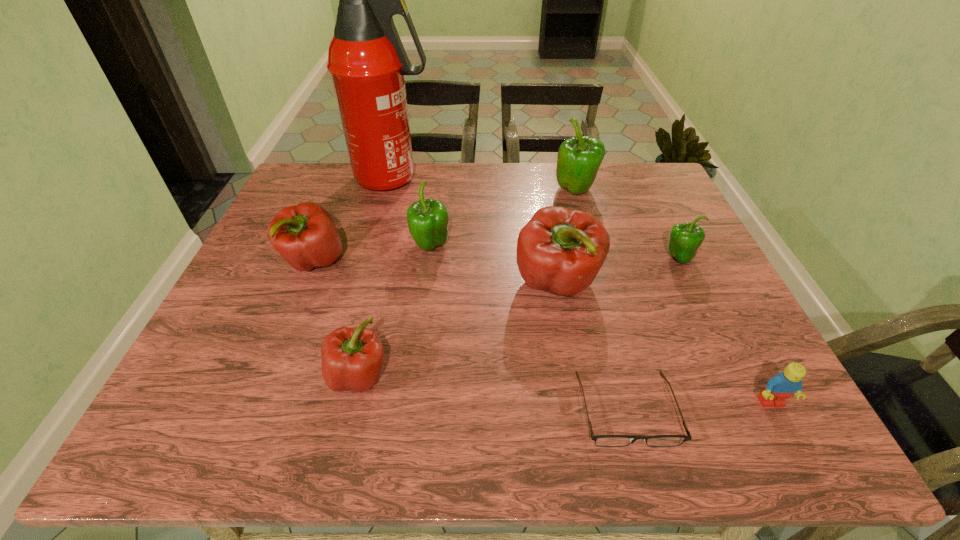
Where is `the nearest pink bell pepper`? the nearest pink bell pepper is located at coordinates (352, 358).

Where is `the nearest bell pepper`? the nearest bell pepper is located at coordinates (352, 358).

This screenshot has width=960, height=540. I want to click on Lego, so click(x=785, y=384).

Where is `spectacles`? The height and width of the screenshot is (540, 960). spectacles is located at coordinates (600, 440).

Identify the location of vacant space located on the trigger side of the fire extinguisher. (466, 179).

Identify the location of vacant space located 0.390m on the left of the biggest green bell pepper. (429, 191).

Image resolution: width=960 pixels, height=540 pixels. What are the coordinates of `blank space located 0.240m on the front of the biggest pink bell pepper` in the screenshot? It's located at (580, 412).

Locate an element on the screen. vacant space situated on the left of the leftmost green bell pepper is located at coordinates (314, 247).

Locate an element on the screen. The height and width of the screenshot is (540, 960). free space located on the back of the second biggest pink bell pepper is located at coordinates (335, 208).

Where is `vacant space located 0.300m on the front of the rightmost bell pepper`? The height and width of the screenshot is (540, 960). vacant space located 0.300m on the front of the rightmost bell pepper is located at coordinates (732, 368).